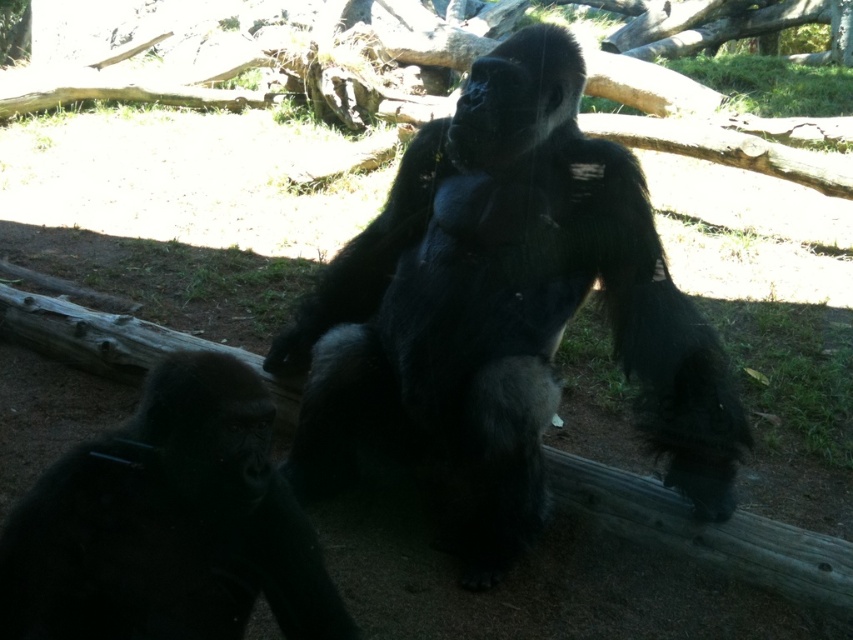
Question: Which object is farther from the camera taking this photo?

Choices:
 (A) black matte gorilla at lower left
 (B) shiny black gorilla at center

Answer: (B)

Question: Which point appears closest to the camera in this image?

Choices:
 (A) (341, 432)
 (B) (49, 515)

Answer: (B)

Question: Is shiny black gorilla at center bigger than black matte gorilla at lower left?

Choices:
 (A) yes
 (B) no

Answer: (A)

Question: Does shiny black gorilla at center have a smaller size compared to black matte gorilla at lower left?

Choices:
 (A) yes
 (B) no

Answer: (B)

Question: Is shiny black gorilla at center bigger than black matte gorilla at lower left?

Choices:
 (A) yes
 (B) no

Answer: (A)